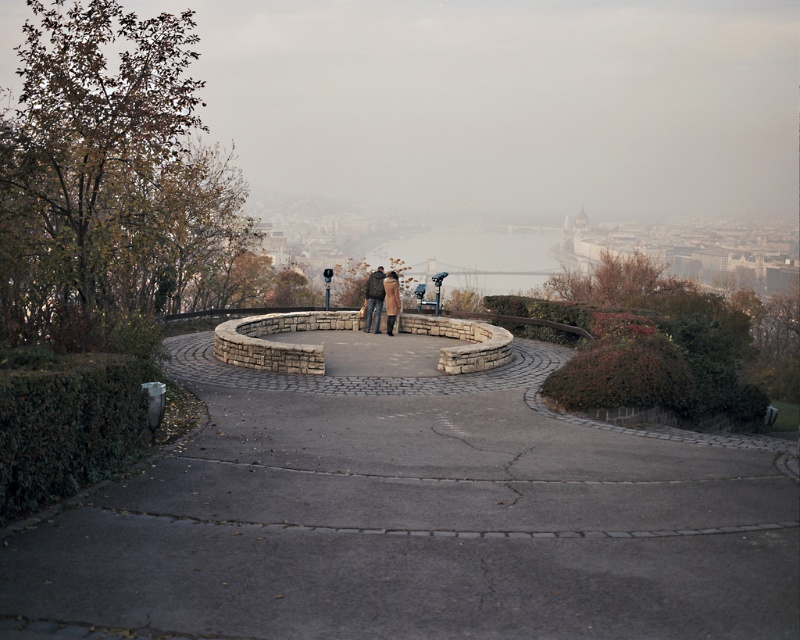
Question: Where is brown leather coat at center located in relation to brown wool coat at center in the image?

Choices:
 (A) below
 (B) above

Answer: (A)

Question: Which of the following is the closest to the observer?

Choices:
 (A) (x=393, y=321)
 (B) (x=389, y=324)

Answer: (B)

Question: Does brown leather coat at center appear on the right side of brown wool coat at center?

Choices:
 (A) yes
 (B) no

Answer: (B)

Question: Is brown leather coat at center below brown wool coat at center?

Choices:
 (A) no
 (B) yes

Answer: (B)

Question: Estimate the real-world distances between objects in this image. Which object is farther from the brown leather coat at center?

Choices:
 (A) brown wool coat at center
 (B) gray concrete path at center

Answer: (B)

Question: Which object is farther from the camera taking this photo?

Choices:
 (A) gray concrete path at center
 (B) brown leather coat at center
 (C) brown wool coat at center

Answer: (B)